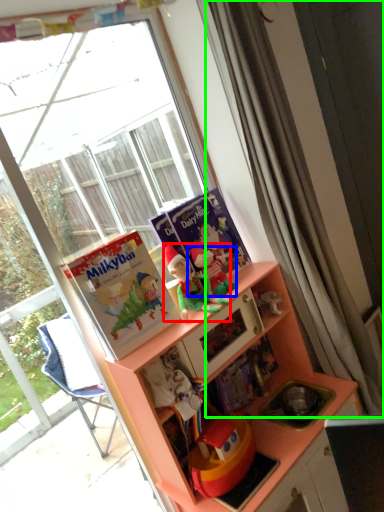
Question: Considering the real-world distances, which object is closest to toy (highlighted by a red box)? toy (highlighted by a blue box) or curtain (highlighted by a green box).

Choices:
 (A) toy
 (B) curtain

Answer: (A)